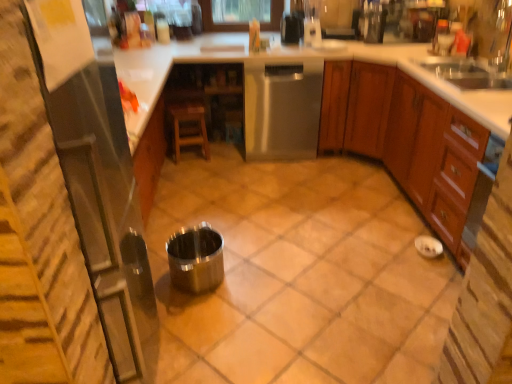
Find the location of a particular element. This screenshot has width=512, height=384. vacant area that is in front of polished metallic cup at center, marked as the second appliance in a front-to-back arrangement is located at coordinates (212, 326).